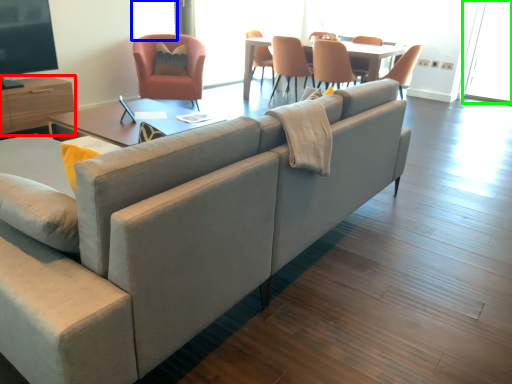
Question: Based on their relative distances, which object is farther from entertainment center (highlighted by a red box)? Choose from window screen (highlighted by a blue box) and window screen (highlighted by a green box).

Choices:
 (A) window screen
 (B) window screen

Answer: (B)